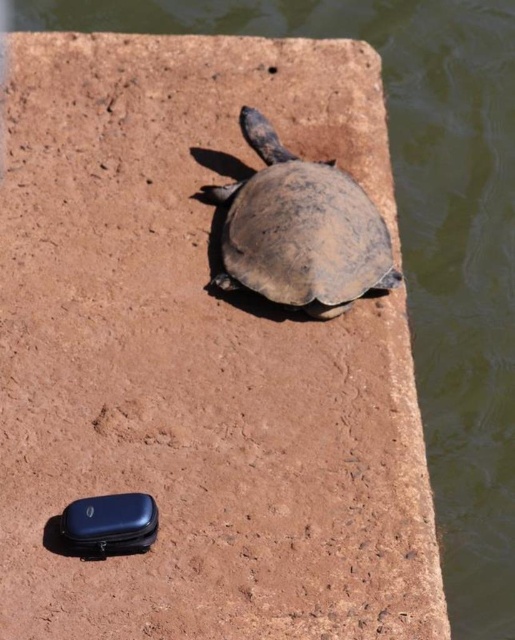
Question: Among these points, which one is farthest from the camera?

Choices:
 (A) (91, 497)
 (B) (264, 128)

Answer: (B)

Question: Which object is farther from the camera taking this photo?

Choices:
 (A) matte black phone case at lower left
 (B) brown matte tortoise at center

Answer: (B)

Question: Can you confirm if brown matte tortoise at center is positioned below matte black phone case at lower left?

Choices:
 (A) yes
 (B) no

Answer: (B)

Question: Can you confirm if brown matte tortoise at center is positioned to the left of matte black phone case at lower left?

Choices:
 (A) no
 (B) yes

Answer: (A)

Question: Which point is closer to the camera?

Choices:
 (A) matte black phone case at lower left
 (B) brown matte tortoise at center

Answer: (A)

Question: Does brown matte tortoise at center appear over matte black phone case at lower left?

Choices:
 (A) no
 (B) yes

Answer: (B)